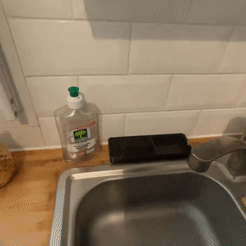
The image size is (246, 246). Identify the location of sponge. (146, 153).